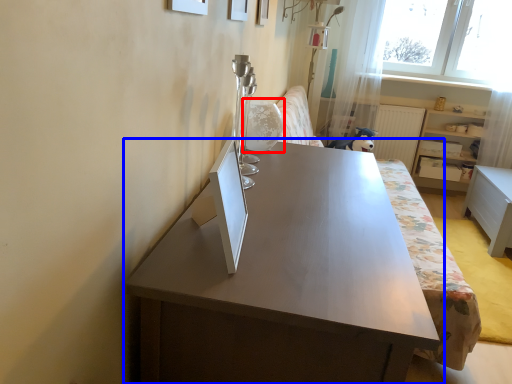
Question: Which object is further to the camera taking this photo, swivel chair (highlighted by a red box) or table (highlighted by a blue box)?

Choices:
 (A) swivel chair
 (B) table

Answer: (A)